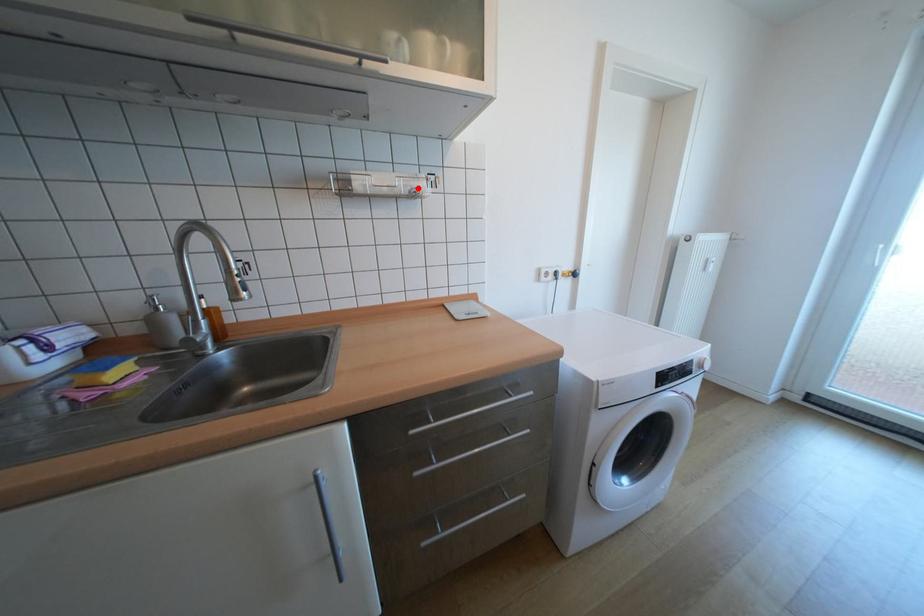
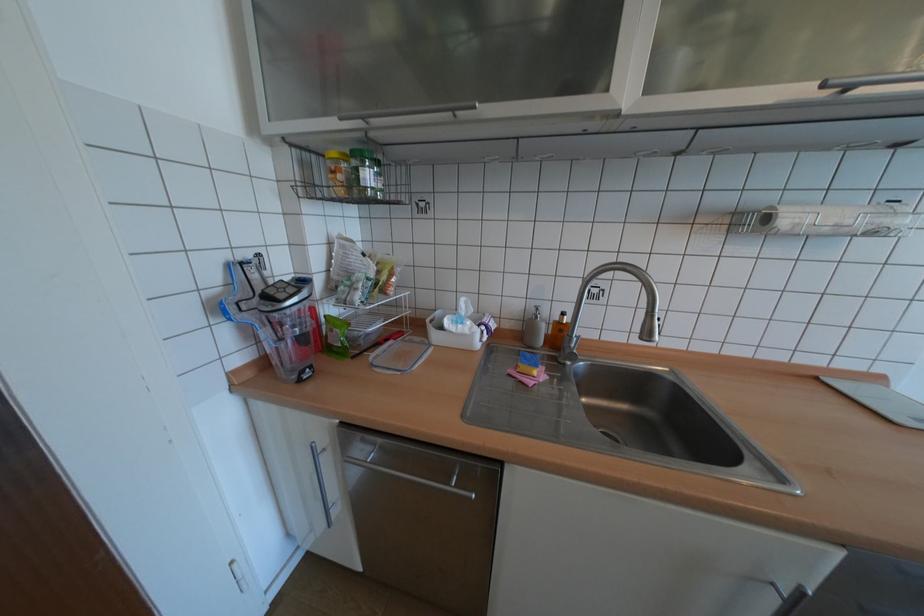
Question: I am providing you with two images of the same scene from different viewpoints. A red point is marked on the first image. At the location where the point appears in image 1, is it still visible in image 2?

Choices:
 (A) Yes
 (B) No

Answer: (A)